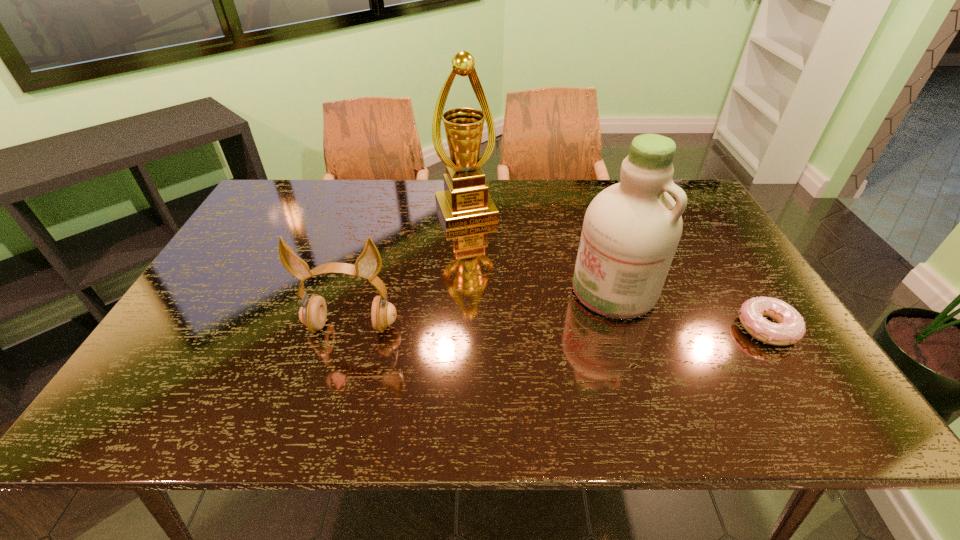
Image resolution: width=960 pixels, height=540 pixels. I want to click on the leftmost object, so [x=313, y=312].

The height and width of the screenshot is (540, 960). What are the coordinates of `the second shortest object` in the screenshot? It's located at (313, 312).

This screenshot has width=960, height=540. I want to click on doughnut, so click(x=790, y=329).

The image size is (960, 540). Identify the location of the rightmost object. (790, 329).

The image size is (960, 540). I want to click on the third object from right to left, so click(x=465, y=201).

What are the coordinates of `the farthest object` in the screenshot? It's located at (465, 201).

The width and height of the screenshot is (960, 540). In order to click on the second tallest object in this screenshot , I will do `click(631, 230)`.

Where is `cleansing agent`? cleansing agent is located at coordinates (631, 230).

Image resolution: width=960 pixels, height=540 pixels. Find the location of `free point located on the front-facing side of the leftmost object`. free point located on the front-facing side of the leftmost object is located at coordinates (338, 373).

Where is `free space located on the back of the shortest object`? free space located on the back of the shortest object is located at coordinates pyautogui.click(x=744, y=294).